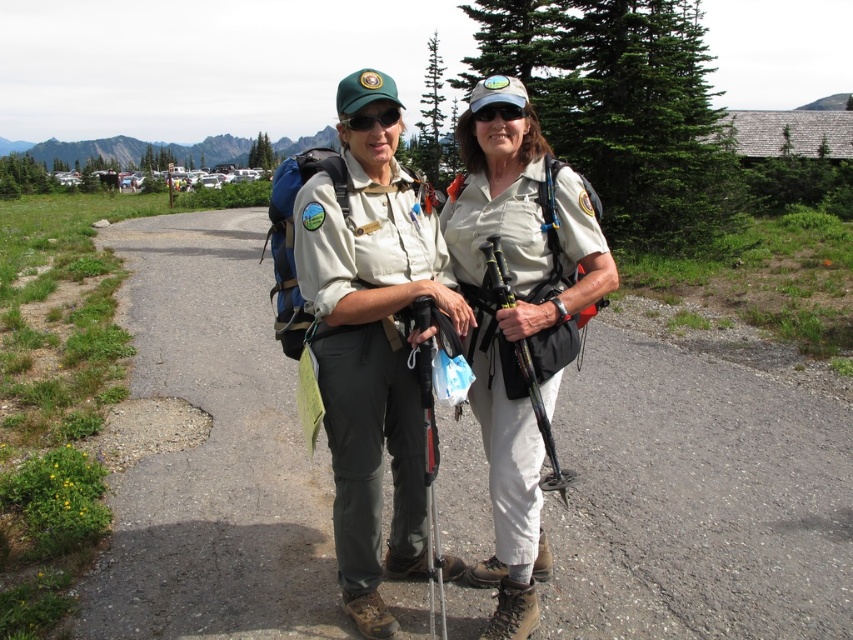
Question: Which of these objects is positioned farthest from the black rubber ski pole at center?

Choices:
 (A) khaki uniform at center
 (B) matte black goggles at center
 (C) green matte sunglasses at center
 (D) metallic silver ski pole at center

Answer: (C)

Question: Which object is the farthest from the matte black goggles at center?

Choices:
 (A) black rubber ski pole at center
 (B) green matte sunglasses at center
 (C) khaki uniform at center

Answer: (A)

Question: Does metallic silver ski pole at center have a lesser width compared to black rubber ski pole at center?

Choices:
 (A) yes
 (B) no

Answer: (A)

Question: Can you confirm if black rubber ski pole at center is positioned below matte black goggles at center?

Choices:
 (A) yes
 (B) no

Answer: (A)

Question: Which object appears closest to the camera in this image?

Choices:
 (A) green matte sunglasses at center
 (B) matte black goggles at center
 (C) khaki uniform at center
 (D) metallic silver ski pole at center

Answer: (D)

Question: Observing the image, what is the correct spatial positioning of green matte sunglasses at center in reference to matte black goggles at center?

Choices:
 (A) below
 (B) above

Answer: (A)